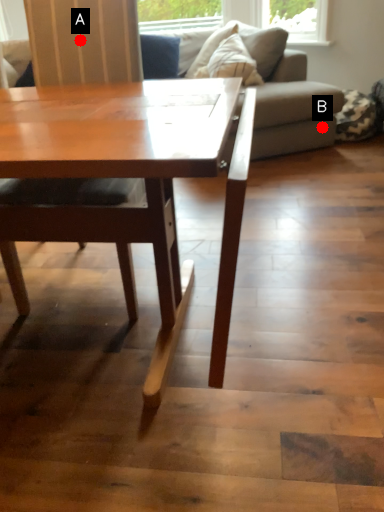
Question: Two points are circled on the image, labeled by A and B beside each circle. Which point appears farthest from the camera in this image?

Choices:
 (A) A is further
 (B) B is further

Answer: (B)